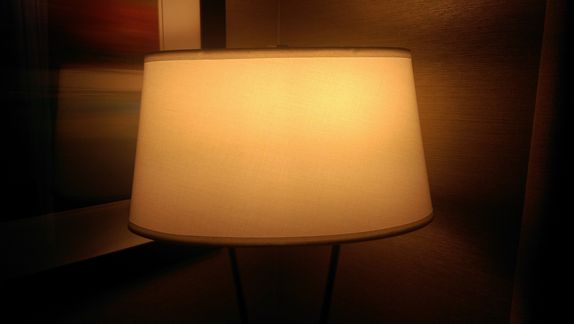
Find the location of a particular element. The image size is (574, 324). light is located at coordinates (108, 140).